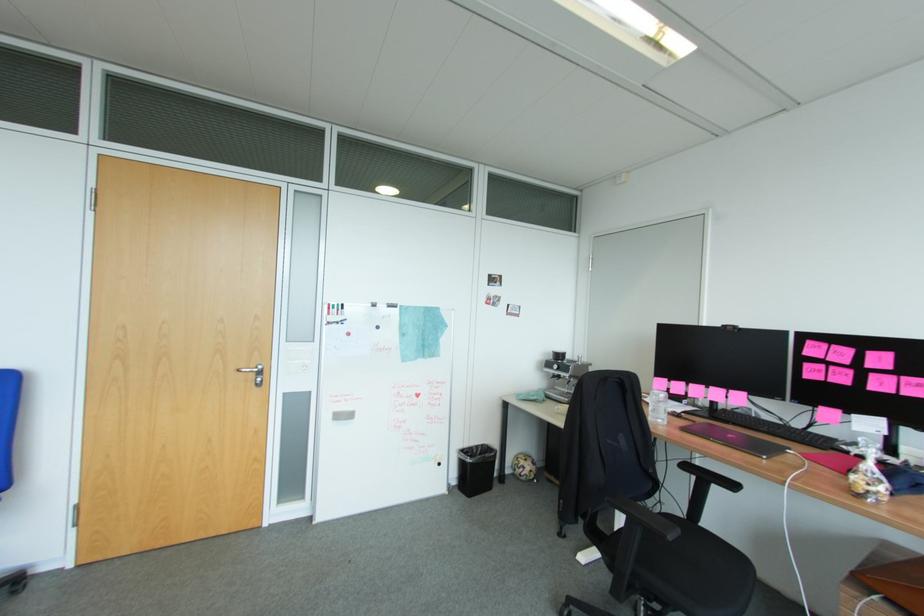
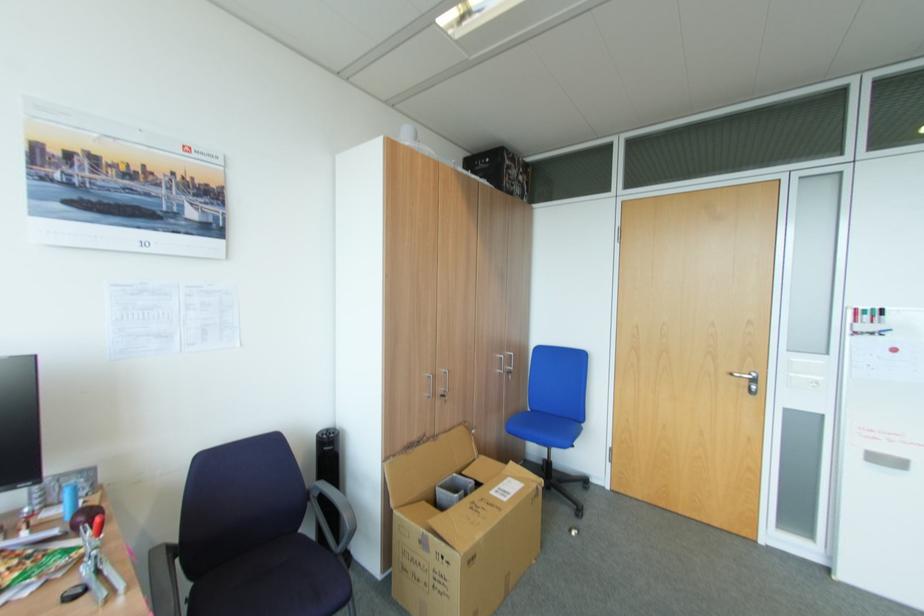
In the second image, find the point that corresponds to point 258,374 in the first image.

(751, 381)